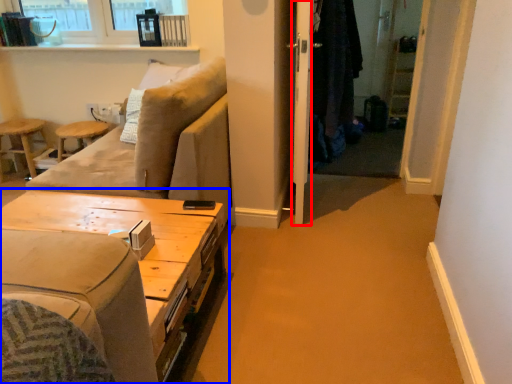
Question: Which point is closer to the camera, screen door (highlighted by a red box) or table (highlighted by a blue box)?

Choices:
 (A) screen door
 (B) table

Answer: (B)